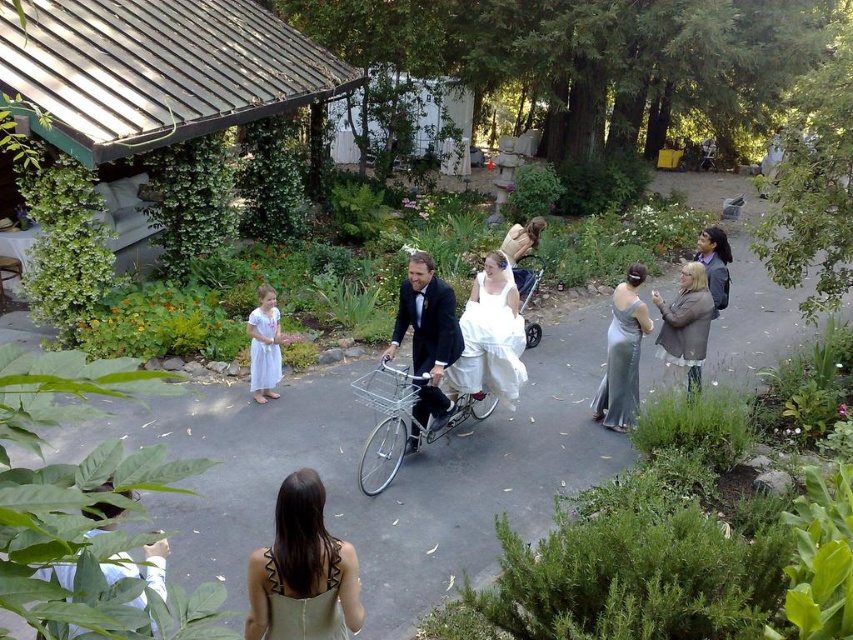
Who is taller, shiny black suit at center or green textured dress at lower center?

With more height is shiny black suit at center.

Can you confirm if shiny black suit at center is smaller than green textured dress at lower center?

No.

Between point (422, 308) and point (317, 593), which one is positioned in front?

Positioned in front is point (317, 593).

Find the location of `shiny black suit at center`. shiny black suit at center is located at coordinates (427, 336).

Does light green fabric dress at lower center lie in front of satin silver dress at center?

Yes, it is in front of satin silver dress at center.

Which is in front, point (346, 572) or point (613, 336)?

Point (346, 572) is more forward.

The height and width of the screenshot is (640, 853). What do you see at coordinates (302, 570) in the screenshot? I see `light green fabric dress at lower center` at bounding box center [302, 570].

What are the coordinates of `light green fabric dress at lower center` in the screenshot? It's located at (302, 570).

Measure the distance between light green fabric dress at lower center and green textured dress at lower center.

The distance of light green fabric dress at lower center from green textured dress at lower center is 1.59 inches.

What do you see at coordinates (302, 570) in the screenshot?
I see `light green fabric dress at lower center` at bounding box center [302, 570].

Which is behind, point (260, 602) or point (281, 580)?

The point (260, 602) is more distant.

Identify the location of light green fabric dress at lower center. The width and height of the screenshot is (853, 640). (302, 570).